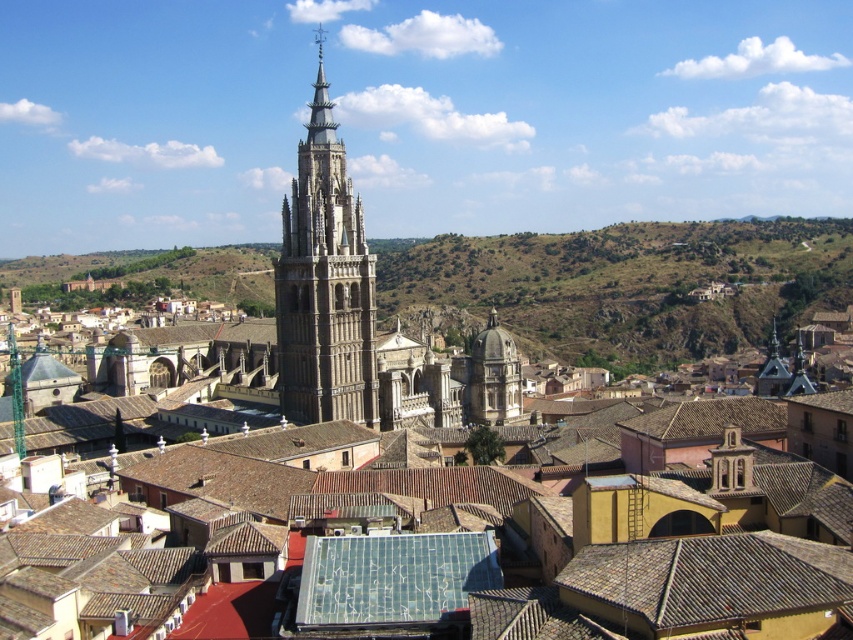
You are a drone operator tasked with capturing aerial footage of Toledo. Your drone has a maximum flight range of 160 meters. You need to fly from the brown rocky hillside at center to the stone gothic tower at center. Can your drone complete this flight without needing a recharge?

The distance between the brown rocky hillside at center and the stone gothic tower at center is 159.91 meters, which is just under the drone operator maximum flight range of 160 meters. The drone can complete the flight without needing a recharge.

You are a tourist standing on a viewing platform in Toledo, Spain. You see the brown tile roof at lower right and the stone gothic tower at center. Which structure is closer to you?

The brown tile roof at lower right is closer to you because it is in front of the stone gothic tower at center.

Based on the photo, you are a tourist standing on a hill overlooking Toledo, Spain. You notice the brown tile roof at lower right and the stone gothic tower at center. Which structure appears wider from your vantage point?

The stone gothic tower at center appears wider than the brown tile roof at lower right because the brown tile roof at lower right has a lesser width compared to the stone gothic tower at center.